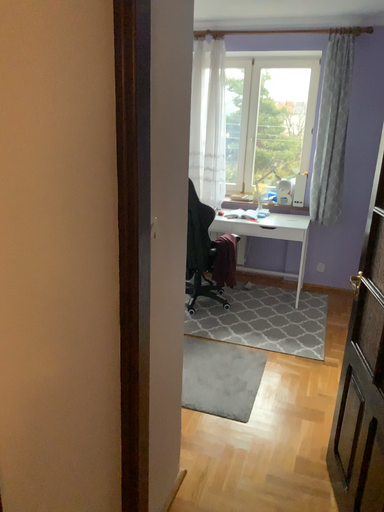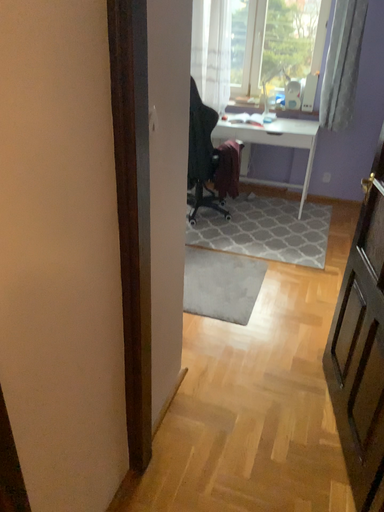
Question: Which way did the camera rotate in the video?

Choices:
 (A) rotated upward
 (B) rotated downward

Answer: (B)